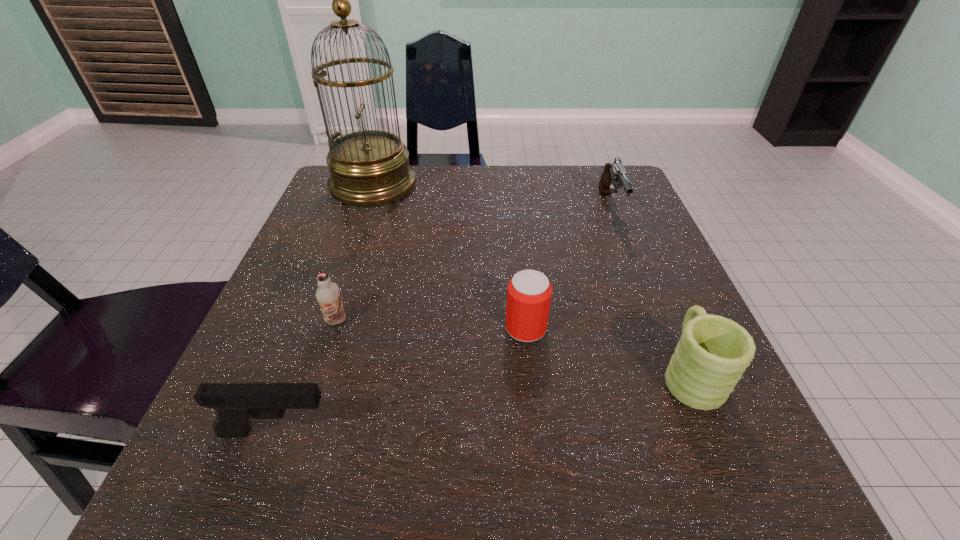
Where is `pistol that is at the left edge`? The image size is (960, 540). pistol that is at the left edge is located at coordinates (235, 403).

Image resolution: width=960 pixels, height=540 pixels. Identify the location of pistol at the right edge. (614, 176).

Where is `mug at the right edge`? The height and width of the screenshot is (540, 960). mug at the right edge is located at coordinates (713, 352).

The height and width of the screenshot is (540, 960). What are the coordinates of `object at the far left corner` in the screenshot? It's located at (370, 167).

Where is `object at the near left corner`? Image resolution: width=960 pixels, height=540 pixels. object at the near left corner is located at coordinates (235, 403).

The width and height of the screenshot is (960, 540). Find the location of `object that is at the far right corner`. object that is at the far right corner is located at coordinates (614, 176).

In the image, there is a desktop. Where is `vacant space at the far edge`? vacant space at the far edge is located at coordinates (511, 181).

Locate an element on the screen. The image size is (960, 540). vacant space at the near edge is located at coordinates (560, 497).

In the image, there is a desktop. Where is `vacant space at the left edge`? vacant space at the left edge is located at coordinates (295, 293).

This screenshot has width=960, height=540. I want to click on vacant region at the right edge, so click(675, 325).